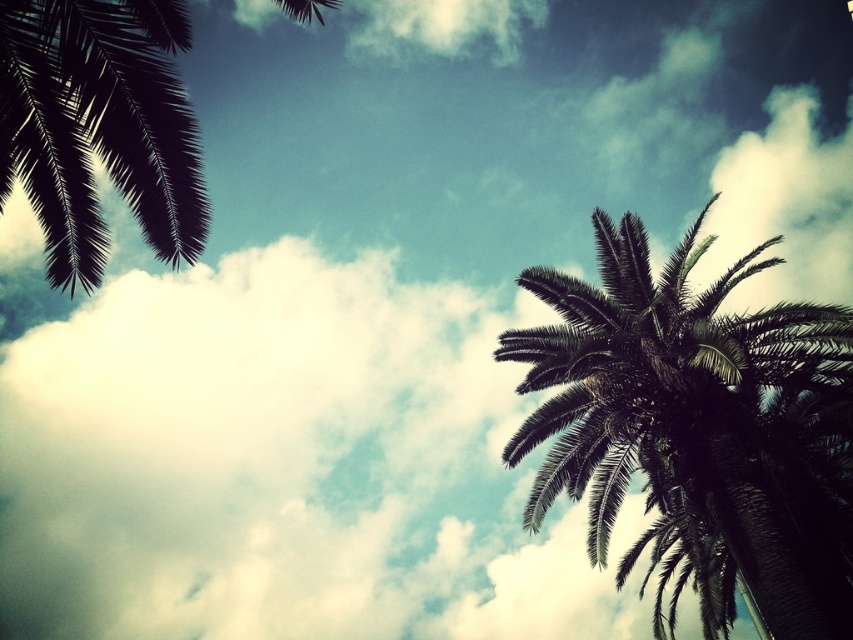
Who is higher up, dark green leafy palm tree at right or dark green leafy palm tree at upper left?

Positioned higher is dark green leafy palm tree at upper left.

Does dark green leafy palm tree at right have a larger size compared to dark green leafy palm tree at upper left?

No, dark green leafy palm tree at right is not bigger than dark green leafy palm tree at upper left.

Is point (579, 346) positioned in front of point (120, 177)?

No, it is not.

Image resolution: width=853 pixels, height=640 pixels. Find the location of `dark green leafy palm tree at right`. dark green leafy palm tree at right is located at coordinates (698, 428).